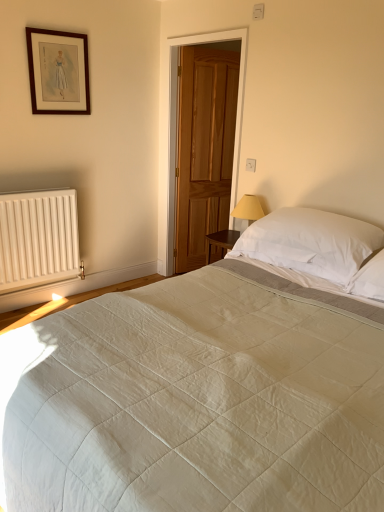
Question: Looking at their shapes, would you say white quilted bed at center is wider or thinner than white soft pillow at upper right?

Choices:
 (A) thin
 (B) wide

Answer: (B)

Question: Is white quilted bed at center taller or shorter than white soft pillow at upper right?

Choices:
 (A) tall
 (B) short

Answer: (A)

Question: Which object is the closest to the wooden picture frame at upper left?

Choices:
 (A) white matte radiator at lower left
 (B) glossy wood door at center
 (C) white soft pillow at upper right
 (D) white quilted bed at center

Answer: (A)

Question: Which object is positioned closest to the wooden picture frame at upper left?

Choices:
 (A) white quilted bed at center
 (B) glossy wood door at center
 (C) white soft pillow at upper right
 (D) white matte radiator at lower left

Answer: (D)